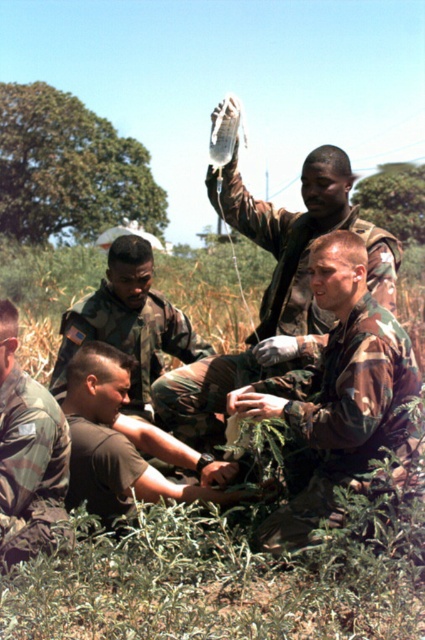
Question: Does brown camo uniform at center come in front of camouflage uniform at lower left?

Choices:
 (A) no
 (B) yes

Answer: (A)

Question: Does camouflage fabric uniform at center appear on the left side of camouflage uniform at center?

Choices:
 (A) yes
 (B) no

Answer: (B)

Question: Considering the real-world distances, which object is closest to the camouflage fabric uniform at center?

Choices:
 (A) camouflage uniform at lower left
 (B) green camouflage uniform at center
 (C) brown camo uniform at center

Answer: (C)

Question: Which object appears farthest from the camera in this image?

Choices:
 (A) camouflage uniform at center
 (B) camouflage fabric uniform at center
 (C) brown camo uniform at center
 (D) green camouflage uniform at center

Answer: (D)

Question: Can you confirm if camouflage fabric uniform at center is positioned below camouflage uniform at lower left?

Choices:
 (A) yes
 (B) no

Answer: (B)

Question: Which point is farther to the camera?

Choices:
 (A) (70, 324)
 (B) (189, 435)

Answer: (A)